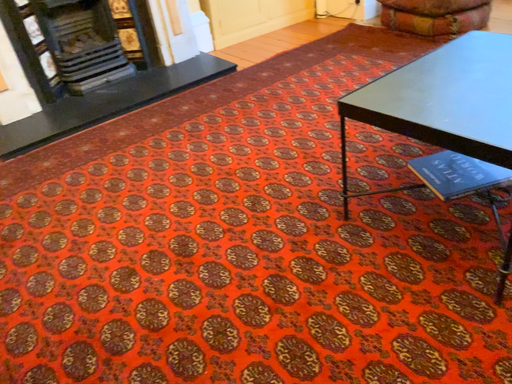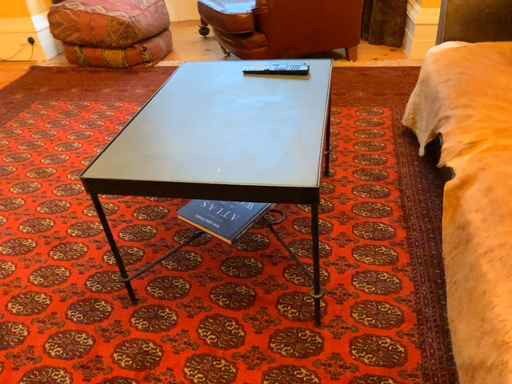
Question: How did the camera likely rotate when shooting the video?

Choices:
 (A) rotated upward
 (B) rotated downward

Answer: (A)